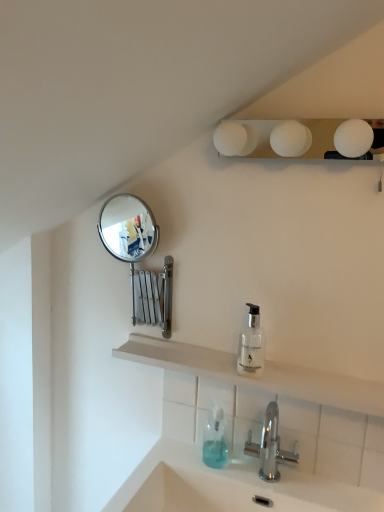
Locate an element on the screen. vacant space to the right of transparent glass soap dispenser at center, the 2th soap dispenser in the bottom-to-top sequence is located at coordinates 314,376.